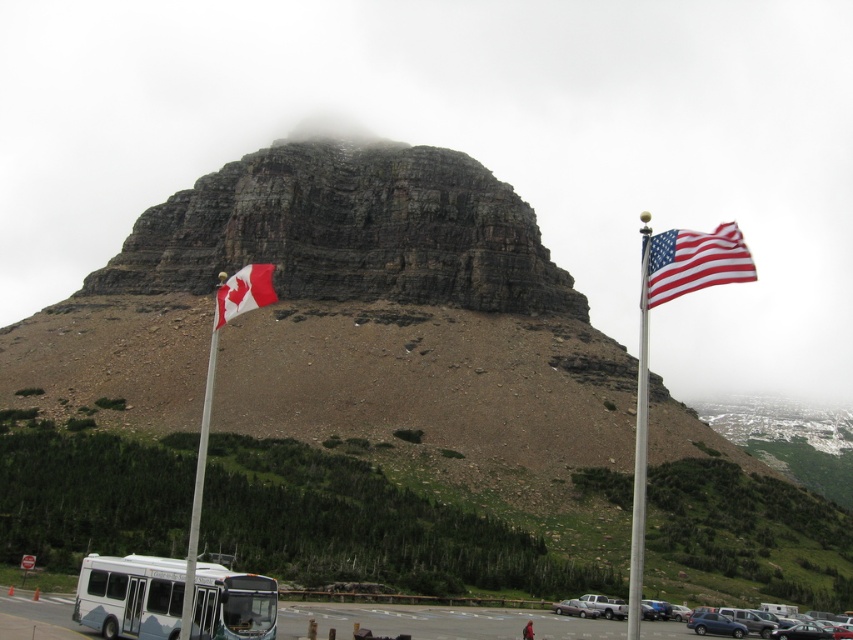
Question: Is red-white striped fabric flag at right to the right of red and white fabric flag at left from the viewer's perspective?

Choices:
 (A) no
 (B) yes

Answer: (B)

Question: From the image, what is the correct spatial relationship of white matte bus at lower left in relation to polished metal flagpole at right?

Choices:
 (A) left
 (B) right

Answer: (A)

Question: Which object appears closest to the camera in this image?

Choices:
 (A) metallic silver sedan at lower center
 (B) polished metal flagpole at right

Answer: (B)

Question: Estimate the real-world distances between objects in this image. Which object is farther from the polished metal flagpole at right?

Choices:
 (A) metallic gray cars at lower right
 (B) metallic blue sedan at lower right
 (C) metallic silver sedan at lower right

Answer: (B)

Question: Among these points, which one is nearest to the camera?

Choices:
 (A) tap(111, 580)
 (B) tap(695, 620)

Answer: (A)

Question: Is white plastic flag pole at left wider than metallic silver sedan at lower right?

Choices:
 (A) yes
 (B) no

Answer: (A)